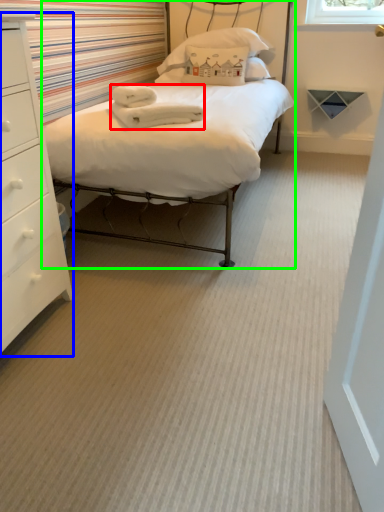
Question: Which is farther away from material (highlighted by a red box)? chest of drawers (highlighted by a blue box) or bed (highlighted by a green box)?

Choices:
 (A) chest of drawers
 (B) bed

Answer: (A)